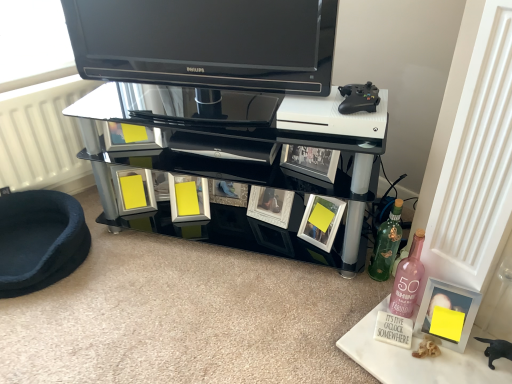
At what (x,y) coordinates should I click in order to perform the action: click on vacant space that is in between black glass shelf at center and dark blue plush pet bed at lower left. Please return your answer as a coordinate pair (x, y). The image size is (512, 384). Looking at the image, I should click on (163, 281).